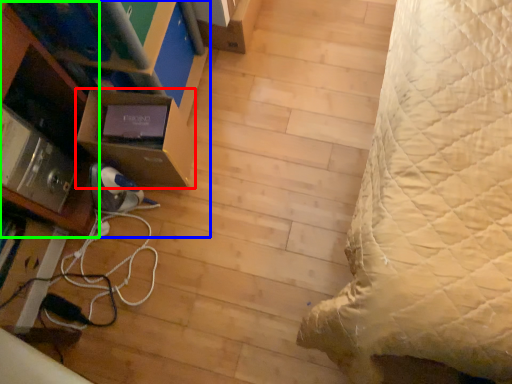
Question: Considering the real-world distances, which object is closest to shelf (highlighted by a red box)? furniture (highlighted by a blue box) or shelf (highlighted by a green box).

Choices:
 (A) furniture
 (B) shelf

Answer: (B)